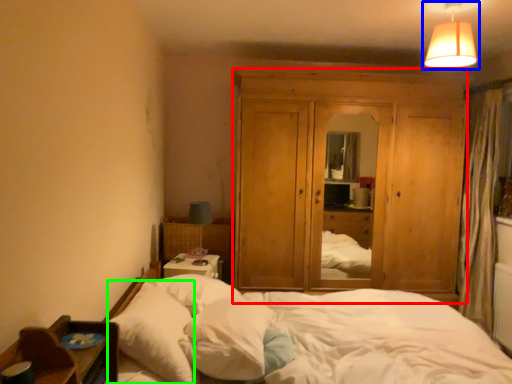
Question: Based on their relative distances, which object is farther from dresser (highlighted by a red box)? Choose from lamp (highlighted by a blue box) and pillow (highlighted by a green box).

Choices:
 (A) lamp
 (B) pillow

Answer: (B)